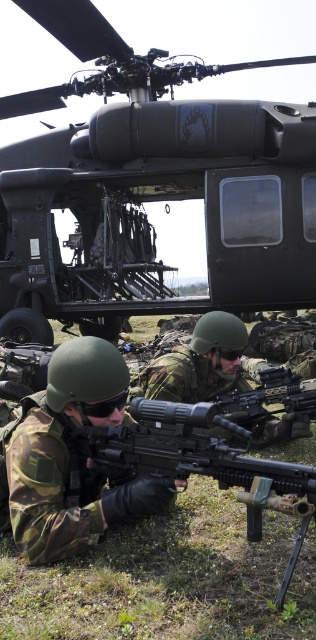
Question: Is camo fabric rifle at center wider than camouflage uniform at center?

Choices:
 (A) no
 (B) yes

Answer: (A)

Question: Does matte black helicopter at center come in front of matte black rifle at center?

Choices:
 (A) yes
 (B) no

Answer: (B)

Question: Can you confirm if matte black helicopter at center is positioned above camo fabric rifle at center?

Choices:
 (A) no
 (B) yes

Answer: (B)

Question: Among these points, which one is farthest from the camera?

Choices:
 (A) (228, 428)
 (B) (251, 362)
 (C) (158, 276)

Answer: (C)

Question: Which object appears closest to the camera in this image?

Choices:
 (A) matte black rifle at center
 (B) camouflage uniform at center
 (C) camo fabric rifle at center

Answer: (A)

Question: Among these points, which one is farthest from the camera?

Choices:
 (A) [x=79, y=545]
 (B) [x=38, y=156]
 (C) [x=189, y=468]
 (D) [x=149, y=380]

Answer: (B)